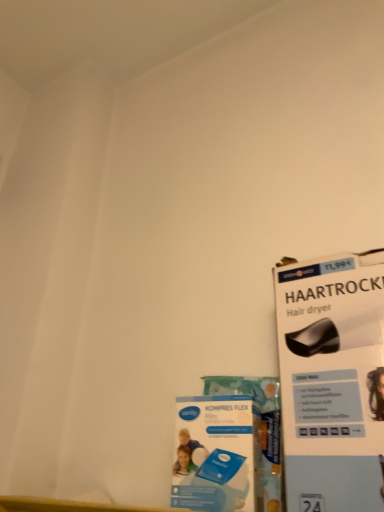
Question: Considering the relative sizes of white cardboard hair dryer at upper right and blue cardboard flyer at lower center in the image provided, is white cardboard hair dryer at upper right wider than blue cardboard flyer at lower center?

Choices:
 (A) no
 (B) yes

Answer: (B)

Question: Is white cardboard hair dryer at upper right oriented towards blue cardboard flyer at lower center?

Choices:
 (A) no
 (B) yes

Answer: (A)

Question: Does white cardboard hair dryer at upper right come in front of blue cardboard flyer at lower center?

Choices:
 (A) yes
 (B) no

Answer: (A)

Question: Is white cardboard hair dryer at upper right not near blue cardboard flyer at lower center?

Choices:
 (A) no
 (B) yes

Answer: (A)

Question: Is white cardboard hair dryer at upper right taller than blue cardboard flyer at lower center?

Choices:
 (A) yes
 (B) no

Answer: (A)

Question: From the image's perspective, would you say white cardboard hair dryer at upper right is shown under blue cardboard flyer at lower center?

Choices:
 (A) no
 (B) yes

Answer: (A)

Question: Does blue cardboard flyer at lower center have a larger size compared to white cardboard hair dryer at upper right?

Choices:
 (A) yes
 (B) no

Answer: (B)

Question: From a real-world perspective, is blue cardboard flyer at lower center positioned under white cardboard hair dryer at upper right based on gravity?

Choices:
 (A) yes
 (B) no

Answer: (A)

Question: From the image's perspective, is blue cardboard flyer at lower center located above white cardboard hair dryer at upper right?

Choices:
 (A) yes
 (B) no

Answer: (B)

Question: Does blue cardboard flyer at lower center contain white cardboard hair dryer at upper right?

Choices:
 (A) yes
 (B) no

Answer: (B)

Question: Considering the relative sizes of blue cardboard flyer at lower center and white cardboard hair dryer at upper right in the image provided, is blue cardboard flyer at lower center wider than white cardboard hair dryer at upper right?

Choices:
 (A) no
 (B) yes

Answer: (A)

Question: Is blue cardboard flyer at lower center completely or partially outside of white cardboard hair dryer at upper right?

Choices:
 (A) no
 (B) yes

Answer: (B)

Question: Visually, is blue cardboard flyer at lower center positioned to the left or to the right of white cardboard hair dryer at upper right?

Choices:
 (A) left
 (B) right

Answer: (A)